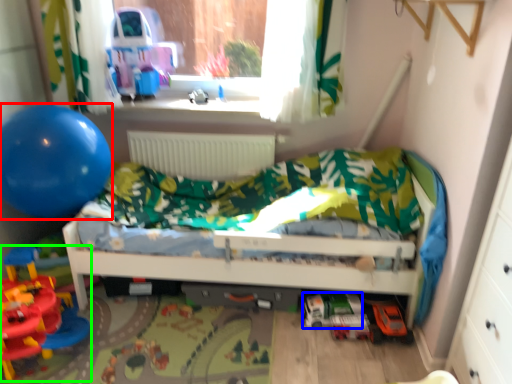
Question: Which object is the closest to the balloon (highlighted by a red box)? Choose among these: toy (highlighted by a blue box) or toy (highlighted by a green box).

Choices:
 (A) toy
 (B) toy

Answer: (B)